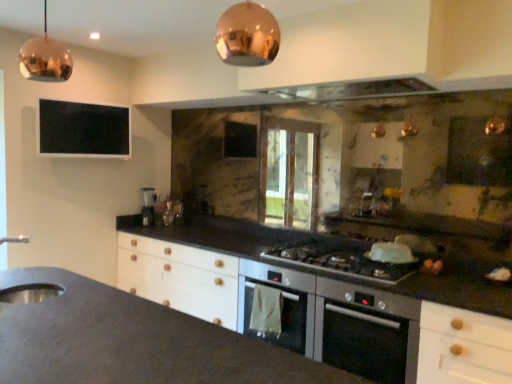
Question: In terms of height, does stainless steel sink at lower left look taller or shorter compared to stainless steel oven at center?

Choices:
 (A) short
 (B) tall

Answer: (A)

Question: Considering their positions, is stainless steel sink at lower left located in front of or behind stainless steel oven at center?

Choices:
 (A) front
 (B) behind

Answer: (A)

Question: Considering the real-world distances, which object is farthest from the stainless steel sink at lower left?

Choices:
 (A) metallic glass at upper center
 (B) satin silver gas stove at center
 (C) copper reflective pendant light at upper left, acting as the 2th light fixture starting from the front
 (D) stainless steel oven at center
 (E) copper reflective pendant light at upper center, the 1th light fixture positioned from the front

Answer: (A)

Question: Estimate the real-world distances between objects in this image. Which object is farther from the stainless steel oven at center?

Choices:
 (A) copper reflective pendant light at upper center, which is the 2th light fixture in back-to-front order
 (B) metallic glass at upper center
 (C) stainless steel sink at lower left
 (D) black matte window screen at upper left
 (E) satin silver blender at center

Answer: (D)